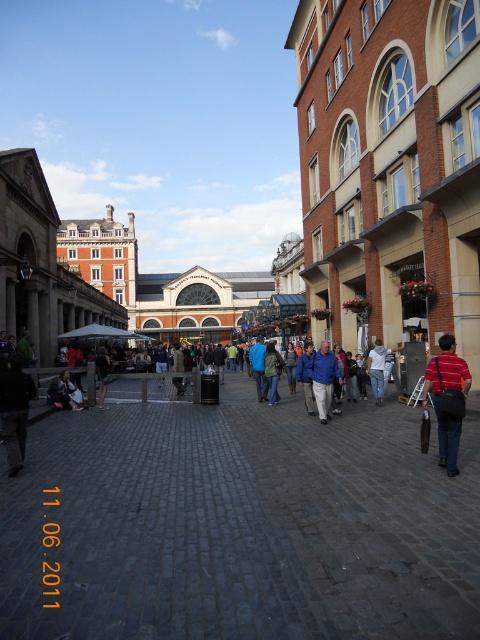
Question: Does striped cotton shirt at lower right have a larger size compared to blue fleece jacket at center?

Choices:
 (A) yes
 (B) no

Answer: (A)

Question: Which point appears farthest from the camera in this image?

Choices:
 (A) (331, 355)
 (B) (454, 424)

Answer: (A)

Question: Among these points, which one is nearest to the camera?

Choices:
 (A) (440, 387)
 (B) (324, 387)

Answer: (A)

Question: Does striped cotton shirt at lower right have a lesser width compared to blue fleece jacket at center?

Choices:
 (A) yes
 (B) no

Answer: (B)

Question: Among these objects, which one is farthest from the camera?

Choices:
 (A) striped cotton shirt at lower right
 (B) blue fleece jacket at center

Answer: (B)

Question: Can you confirm if striped cotton shirt at lower right is positioned to the left of blue fleece jacket at center?

Choices:
 (A) yes
 (B) no

Answer: (B)